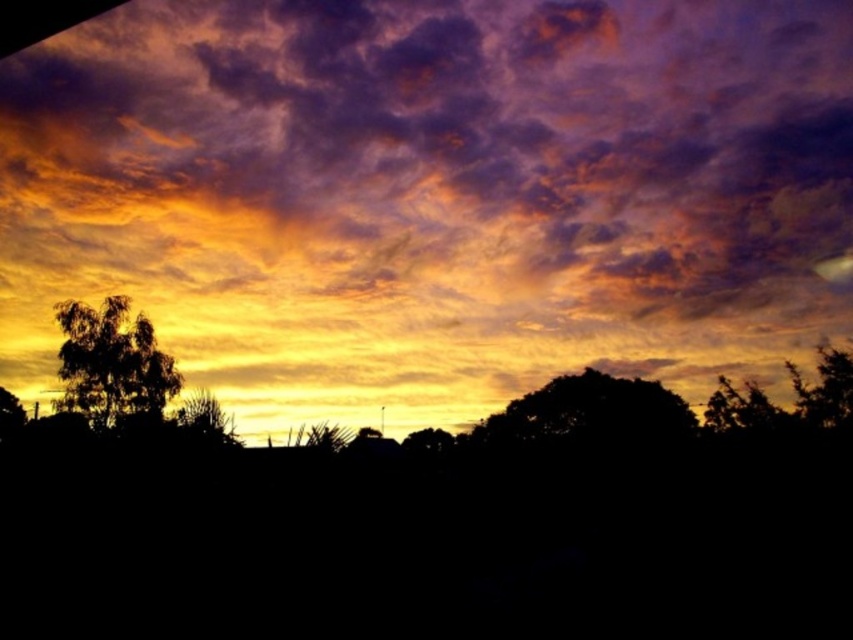
Question: Among these objects, which one is farthest from the camera?

Choices:
 (A) silhouette leafy tree at lower left
 (B) purple cloud at upper center
 (C) green leafy tree at lower left

Answer: (A)

Question: Does silhouette leafy tree at lower left appear on the right side of green leafy tree at lower left?

Choices:
 (A) yes
 (B) no

Answer: (A)

Question: Is the position of silhouette leafy tree at lower left less distant than that of green leafy tree at lower left?

Choices:
 (A) no
 (B) yes

Answer: (A)

Question: Can you confirm if purple cloud at upper center is positioned to the right of silhouette leafy tree at lower left?

Choices:
 (A) no
 (B) yes

Answer: (B)

Question: Among these points, which one is nearest to the camera?

Choices:
 (A) (207, 204)
 (B) (9, 392)
 (C) (158, 376)

Answer: (C)

Question: Which object is the farthest from the green leafy tree at lower left?

Choices:
 (A) silhouette leafy tree at lower left
 (B) purple cloud at upper center

Answer: (B)